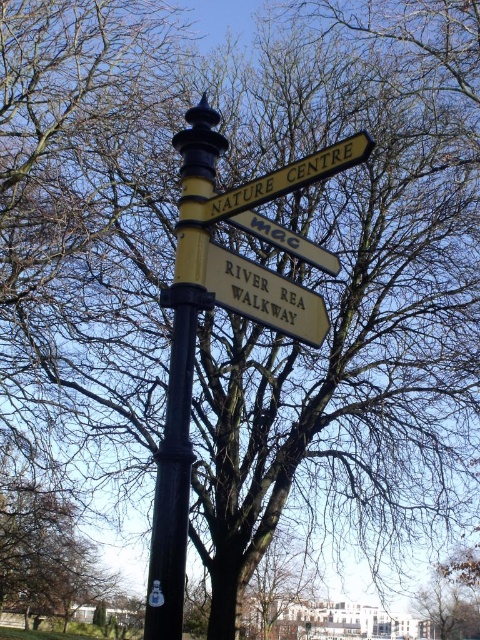
You are standing in front of the signpost and want to take a photo of the black matte pole at center without the bare branches at center appearing in the background. Is this possible?

Yes, because the black matte pole at center is in front of the bare branches at center, so you can position yourself to frame the pole without the branches showing behind it.